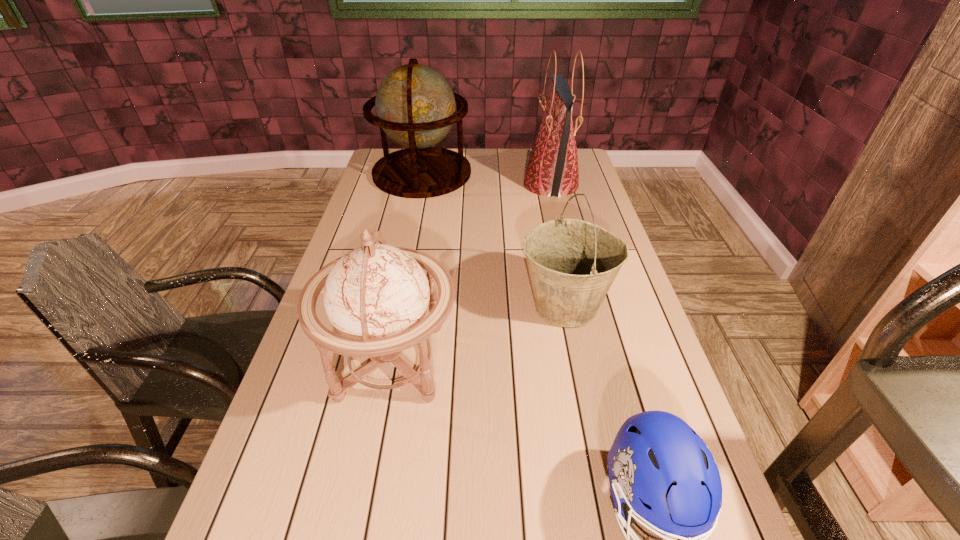
The width and height of the screenshot is (960, 540). Find the location of `handbag at the right edge`. handbag at the right edge is located at coordinates (552, 169).

Locate an element on the screen. wine bucket positioned at the right edge is located at coordinates (572, 264).

This screenshot has width=960, height=540. In order to click on object at the far left corner in this screenshot , I will do `click(415, 106)`.

Locate an element on the screen. The image size is (960, 540). object that is at the far right corner is located at coordinates coord(552,169).

Find the location of a particular element. vacant region at the far edge of the desktop is located at coordinates (485, 158).

Where is `free space at the right edge`? free space at the right edge is located at coordinates (601, 308).

Find the location of a particular element. free space between the farther globe and the wine bucket is located at coordinates (494, 240).

The image size is (960, 540). I want to click on free spot between the handbag and the nearer globe, so click(471, 273).

Find the location of `free space between the handbag and the farther globe`. free space between the handbag and the farther globe is located at coordinates (487, 179).

Locate an element on the screen. Image resolution: width=960 pixels, height=540 pixels. object that is the fourth nearest to the handbag is located at coordinates click(x=659, y=468).